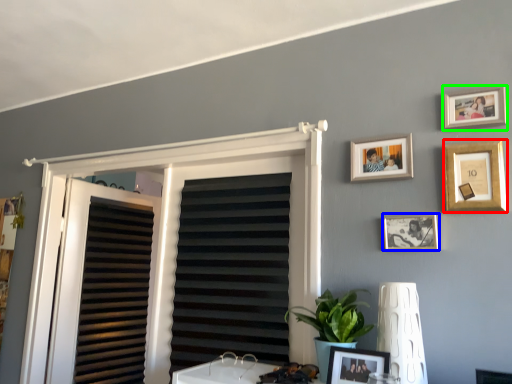
Question: Considering the real-world distances, which object is farthest from picture frame (highlighted by a red box)? picture frame (highlighted by a blue box) or picture frame (highlighted by a green box)?

Choices:
 (A) picture frame
 (B) picture frame

Answer: (A)